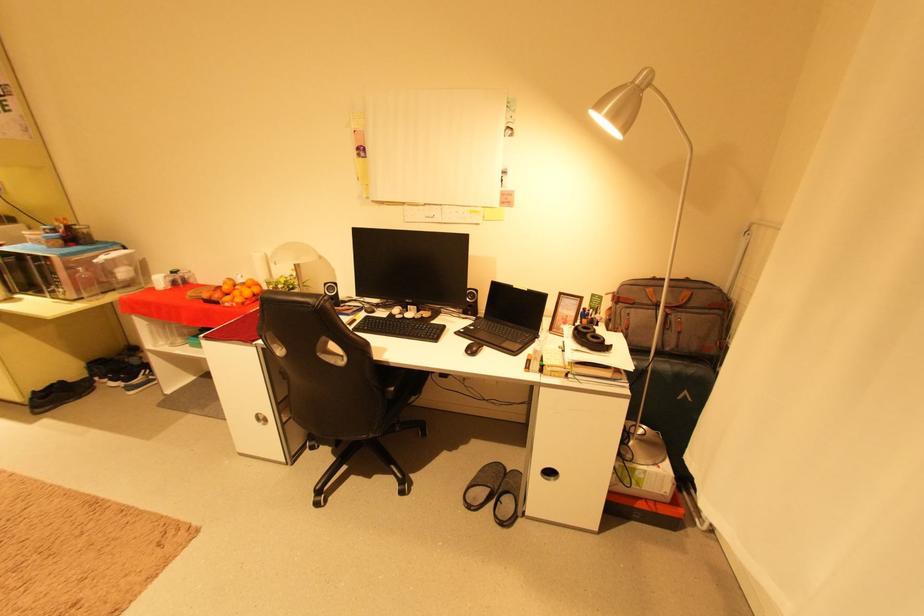
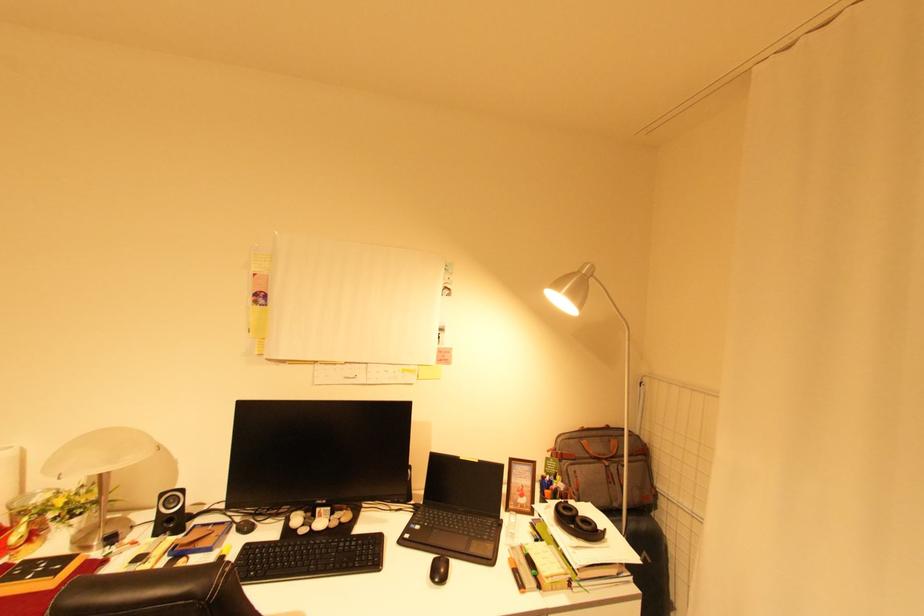
Find the pixel in the second image that matches point (596, 336) in the first image.

(585, 521)